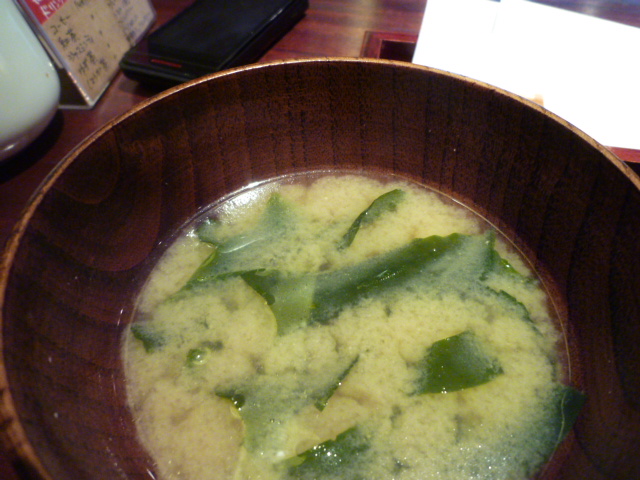
The width and height of the screenshot is (640, 480). Identify the location of phone. (192, 52).